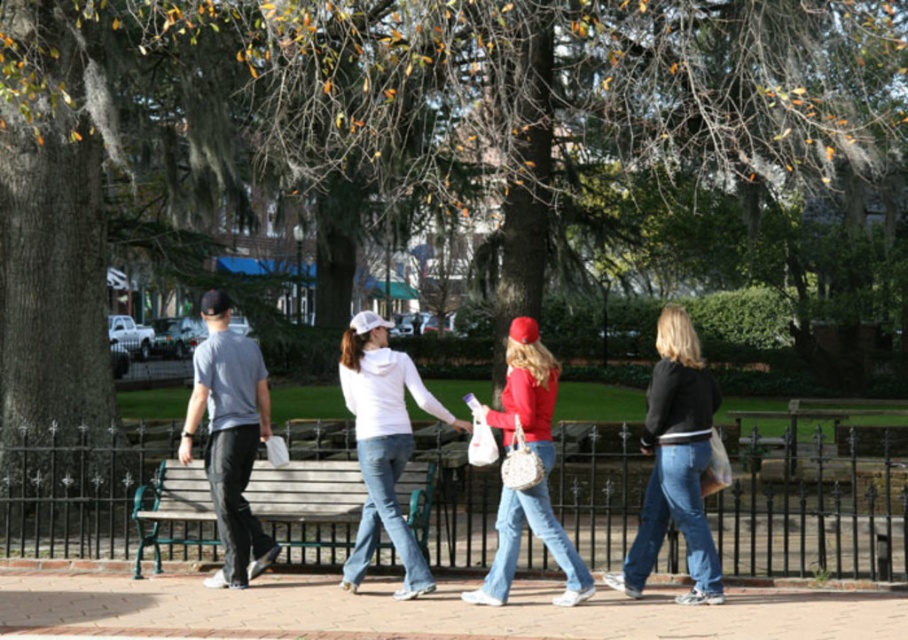
Is denim jeans at center positioned behind matte red jacket at center?

Yes.

Can you confirm if denim jeans at center is bigger than matte red jacket at center?

No.

Is point (668, 340) positioned behind point (504, 536)?

No, it is in front of (504, 536).

In order to click on denim jeans at center in this screenshot , I will do tap(675, 461).

Which is more to the left, denim jeans at center or gray cotton t-shirt at left?

Positioned to the left is gray cotton t-shirt at left.

Between point (665, 426) and point (232, 396), which one is positioned in front?

Point (665, 426) is more forward.

Which is in front, point (699, 564) or point (215, 406)?

Point (699, 564) is in front.

The height and width of the screenshot is (640, 908). Identify the location of denim jeans at center. (675, 461).

The width and height of the screenshot is (908, 640). Describe the element at coordinates (306, 492) in the screenshot. I see `wooden bench at center` at that location.

Where is `wooden bench at center`? Image resolution: width=908 pixels, height=640 pixels. wooden bench at center is located at coordinates (306, 492).

Identify the location of wooden bench at center. (306, 492).